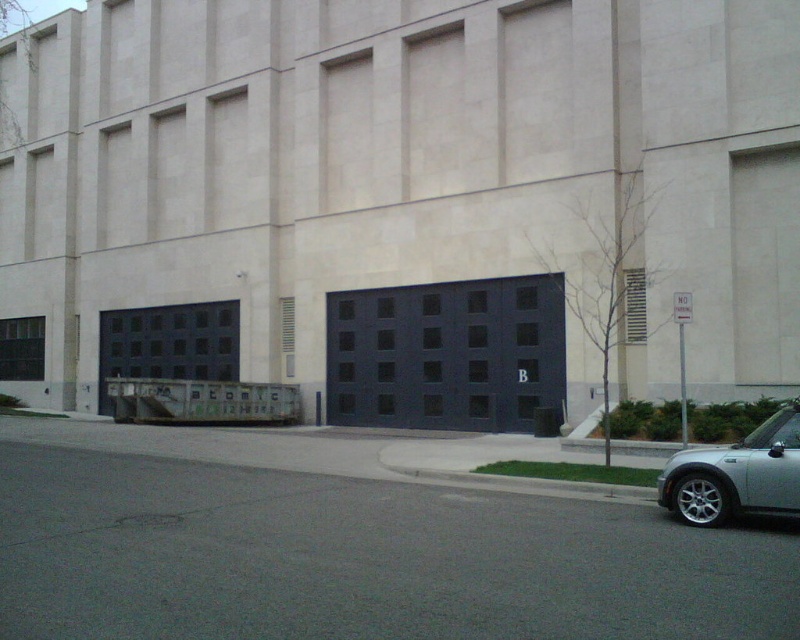
Question: Can you confirm if dark matte garage door at center is wider than silver metallic car at lower right?

Choices:
 (A) no
 (B) yes

Answer: (A)

Question: Does dark matte garage door at center appear on the right side of silver metallic car at lower right?

Choices:
 (A) yes
 (B) no

Answer: (A)

Question: Does dark matte garage door at center have a greater width compared to silver metallic car at lower right?

Choices:
 (A) no
 (B) yes

Answer: (A)

Question: Which of the following is the farthest from the observer?

Choices:
 (A) dark matte garage door at center
 (B) silver metallic car at lower right

Answer: (A)

Question: Which of the following is the closest to the observer?

Choices:
 (A) (392, 312)
 (B) (794, 428)

Answer: (B)